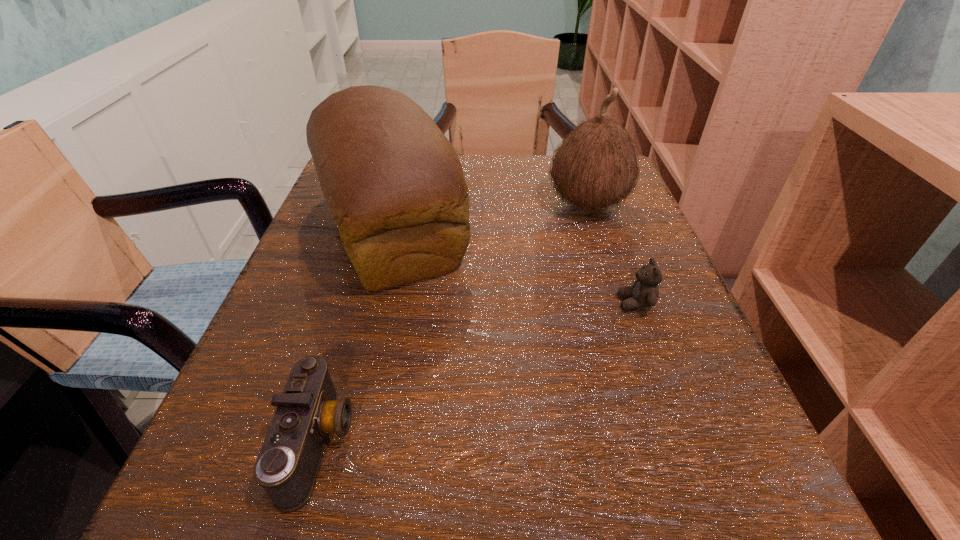
Identify the location of coconut. Image resolution: width=960 pixels, height=540 pixels. (596, 166).

Find the location of a particular element. This screenshot has height=540, width=960. bread is located at coordinates (394, 184).

Identify the location of teddy bear. The width and height of the screenshot is (960, 540). (644, 293).

You are a GUI agent. You are given a task and a screenshot of the screen. Output one action in this format:
    pyautogui.click(x=<x>, y=<y>)
    Task: Click on the nearest object
    
    Given the screenshot: What is the action you would take?
    pyautogui.click(x=308, y=410)

You are a GUI agent. You are given a task and a screenshot of the screen. Output one action in this format:
    pyautogui.click(x=<x>, y=<y>)
    Task: Click on the vacant space located on the surface of the coconut
    The width and height of the screenshot is (960, 540).
    Given the screenshot: What is the action you would take?
    pyautogui.click(x=455, y=205)

Where is `vacant space located 0.120m on the surface of the coconut`? The width and height of the screenshot is (960, 540). vacant space located 0.120m on the surface of the coconut is located at coordinates (489, 205).

Find the location of `vacant region located 0.140m on the surface of the coconut`. vacant region located 0.140m on the surface of the coconut is located at coordinates (479, 205).

You are a GUI agent. You are given a task and a screenshot of the screen. Output one action in this format:
    pyautogui.click(x=<x>, y=<y>)
    Task: Click on the vacant area situated 0.080m on the front of the bread
    Image resolution: width=960 pixels, height=540 pixels.
    Given the screenshot: What is the action you would take?
    361,342

In order to click on free region located on the face of the teddy bear in this screenshot , I will do `click(396, 303)`.

Identify the location of vacant region located 0.280m on the face of the teddy bear. This screenshot has width=960, height=540. (445, 303).